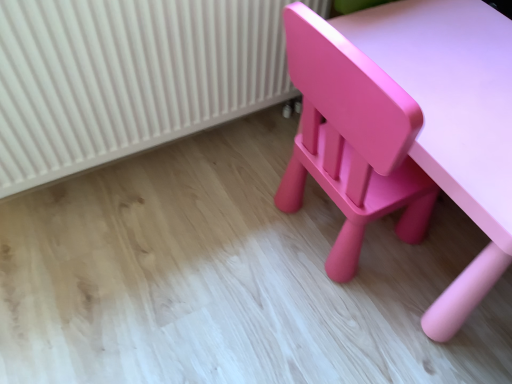
The width and height of the screenshot is (512, 384). I want to click on matte pink table at lower right, so click(x=453, y=122).

What do you see at coordinates (453, 122) in the screenshot? This screenshot has height=384, width=512. I see `matte pink table at lower right` at bounding box center [453, 122].

In order to face matte pink table at lower right, should I rotate leftwards or rightwards?

To align with it, rotate right about 24.293°.

What is the approximate height of matte pink table at lower right?

The height of matte pink table at lower right is 19.14 inches.

Where is `white ribbed radiator at upper left`? white ribbed radiator at upper left is located at coordinates (127, 78).

What do you see at coordinates (127, 78) in the screenshot? This screenshot has width=512, height=384. I see `white ribbed radiator at upper left` at bounding box center [127, 78].

In order to face white ribbed radiator at upper left, should I rotate leftwards or rightwards?

To align with it, rotate left about 11.604°.

Locate an element on the screen. This screenshot has width=512, height=384. matte pink table at lower right is located at coordinates coord(453,122).

Is matte pink table at lower right at the left side of white ribbed radiator at upper left?

In fact, matte pink table at lower right is to the right of white ribbed radiator at upper left.

Does matte pink table at lower right come behind white ribbed radiator at upper left?

No.

Which point is more forward, [439,333] or [200,97]?

Positioned in front is point [439,333].

From the image's perspective, is matte pink table at lower right located above white ribbed radiator at upper left?

No, from the image's perspective, matte pink table at lower right is not over white ribbed radiator at upper left.

From a real-world perspective, does matte pink table at lower right stand above white ribbed radiator at upper left?

Actually, matte pink table at lower right is physically below white ribbed radiator at upper left in the real world.

Does matte pink table at lower right have a lesser width compared to white ribbed radiator at upper left?

No, matte pink table at lower right is not thinner than white ribbed radiator at upper left.

Does matte pink table at lower right have a greater height compared to white ribbed radiator at upper left?

No.

Between matte pink table at lower right and white ribbed radiator at upper left, which one has larger size?

With larger size is matte pink table at lower right.

Is matte pink table at lower right inside the boundaries of white ribbed radiator at upper left, or outside?

matte pink table at lower right is not inside white ribbed radiator at upper left, it's outside.

Is matte pink table at lower right positioned far away from white ribbed radiator at upper left?

No, there isn't a large distance between matte pink table at lower right and white ribbed radiator at upper left.

Is matte pink table at lower right looking in the opposite direction of white ribbed radiator at upper left?

No, matte pink table at lower right's orientation is not away from white ribbed radiator at upper left.

Where is `table in front of the white ribbed radiator at upper left`? This screenshot has height=384, width=512. table in front of the white ribbed radiator at upper left is located at coordinates (453, 122).

Considering the relative positions of white ribbed radiator at upper left and matte pink table at lower right in the image provided, is white ribbed radiator at upper left to the right of matte pink table at lower right from the viewer's perspective?

No, white ribbed radiator at upper left is not to the right of matte pink table at lower right.

Considering the relative positions of white ribbed radiator at upper left and matte pink table at lower right in the image provided, is white ribbed radiator at upper left behind matte pink table at lower right?

Yes, white ribbed radiator at upper left is further from the viewer.

Between point (53, 147) and point (429, 2), which one is positioned in front?

The point (53, 147) is closer.

From the image's perspective, who appears lower, white ribbed radiator at upper left or matte pink table at lower right?

matte pink table at lower right, from the image's perspective.

From a real-world perspective, between white ribbed radiator at upper left and matte pink table at lower right, who is vertically higher?

white ribbed radiator at upper left.

Which of these two, white ribbed radiator at upper left or matte pink table at lower right, is wider?

With larger width is matte pink table at lower right.

Which of these two, white ribbed radiator at upper left or matte pink table at lower right, stands taller?

With more height is white ribbed radiator at upper left.

Between white ribbed radiator at upper left and matte pink table at lower right, which one has larger size?

Bigger between the two is matte pink table at lower right.

Can we say white ribbed radiator at upper left lies outside matte pink table at lower right?

That's correct, white ribbed radiator at upper left is outside of matte pink table at lower right.

Is white ribbed radiator at upper left directly adjacent to matte pink table at lower right?

No, white ribbed radiator at upper left is not making contact with matte pink table at lower right.

Is white ribbed radiator at upper left positioned with its back to matte pink table at lower right?

white ribbed radiator at upper left does not have its back to matte pink table at lower right.

Where is `table in front of the white ribbed radiator at upper left`? This screenshot has height=384, width=512. table in front of the white ribbed radiator at upper left is located at coordinates (453, 122).

This screenshot has width=512, height=384. Identify the location of radiator on the left of matte pink table at lower right. (127, 78).

The image size is (512, 384). I want to click on table that appears below the white ribbed radiator at upper left (from the image's perspective), so click(453, 122).